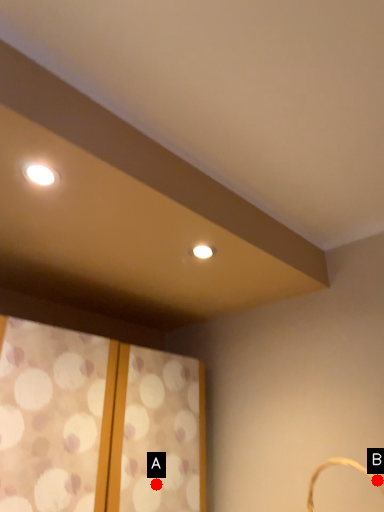
Question: Two points are circled on the image, labeled by A and B beside each circle. Among these points, which one is farthest from the camera?

Choices:
 (A) A is further
 (B) B is further

Answer: (A)